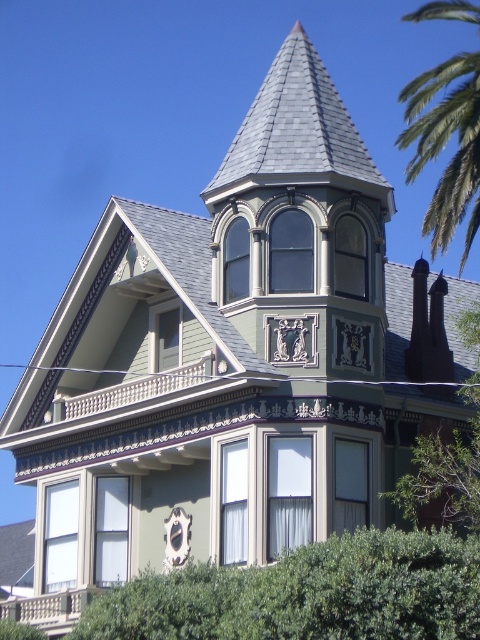
Is green leafy palm tree at upper right closer to camera compared to stone balustrade at lower left?

No, green leafy palm tree at upper right is behind stone balustrade at lower left.

What do you see at coordinates (444, 145) in the screenshot?
I see `green leafy palm tree at upper right` at bounding box center [444, 145].

You are a GUI agent. You are given a task and a screenshot of the screen. Output one action in this format:
    pyautogui.click(x=<x>, y=<y>)
    Task: Click on the green leafy palm tree at upper right
    This screenshot has height=640, width=480.
    Given the screenshot: What is the action you would take?
    pyautogui.click(x=444, y=145)